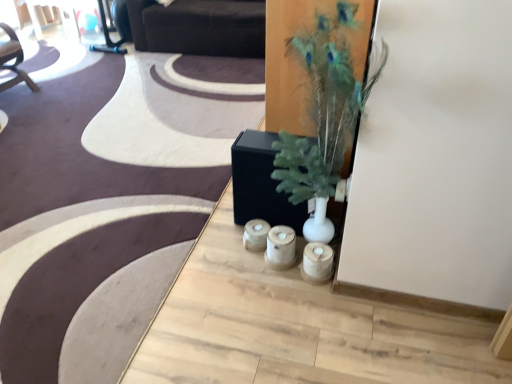
Question: Relative to dark brown leather couch at upper center, is green feathered plant at center in front or behind?

Choices:
 (A) behind
 (B) front

Answer: (B)

Question: Is green feathered plant at center taller or shorter than dark brown leather couch at upper center?

Choices:
 (A) short
 (B) tall

Answer: (B)

Question: Estimate the real-world distances between objects in this image. Which object is closer to the green feathered plant at center?

Choices:
 (A) dark brown leather couch at upper center
 (B) wooden candle holders at center

Answer: (B)

Question: Which is farther from the dark brown leather couch at upper center?

Choices:
 (A) wooden candle holders at center
 (B) green feathered plant at center

Answer: (A)